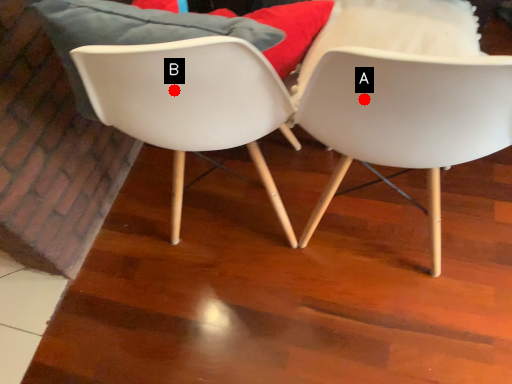
Question: Two points are circled on the image, labeled by A and B beside each circle. Which point appears farthest from the camera in this image?

Choices:
 (A) A is further
 (B) B is further

Answer: (B)